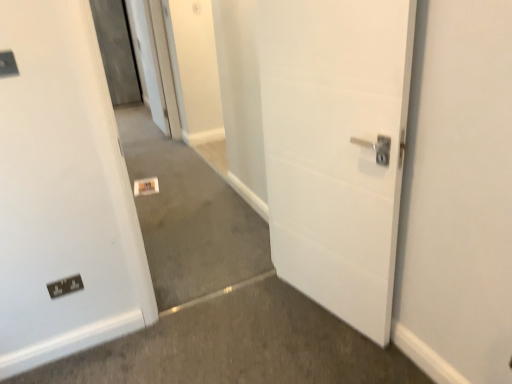
Find the location of a particular element. The height and width of the screenshot is (384, 512). neutral carpet at center is located at coordinates (189, 218).

Can you confirm if black plastic electric outlet at lower left is smaller than neutral carpet at center?

Indeed, black plastic electric outlet at lower left has a smaller size compared to neutral carpet at center.

Based on the photo, is black plastic electric outlet at lower left placed right next to neutral carpet at center?

There is a gap between black plastic electric outlet at lower left and neutral carpet at center.

Is black plastic electric outlet at lower left taller or shorter than neutral carpet at center?

Clearly, black plastic electric outlet at lower left is shorter compared to neutral carpet at center.

Which of these two, black plastic electric outlet at lower left or neutral carpet at center, is thinner?

black plastic electric outlet at lower left is thinner.

Is neutral carpet at center at the right side of matte black switch at upper left?

Yes, neutral carpet at center is to the right of matte black switch at upper left.

Is neutral carpet at center positioned with its back to matte black switch at upper left?

neutral carpet at center does not have its back to matte black switch at upper left.

From the image's perspective, is neutral carpet at center positioned above or below matte black switch at upper left?

Clearly, from the image's perspective, neutral carpet at center is below matte black switch at upper left.

Does neutral carpet at center have a larger size compared to matte black switch at upper left?

Yes, neutral carpet at center is bigger than matte black switch at upper left.

How different are the orientations of neutral carpet at center and black plastic electric outlet at lower left in degrees?

There is a 0.381-degree angle between the facing directions of neutral carpet at center and black plastic electric outlet at lower left.

In the scene shown: Is the depth of neutral carpet at center greater than that of black plastic electric outlet at lower left?

No, it is not.

Is neutral carpet at center to the right of black plastic electric outlet at lower left from the viewer's perspective?

Yes, neutral carpet at center is to the right of black plastic electric outlet at lower left.

Considering the sizes of objects neutral carpet at center and black plastic electric outlet at lower left in the image provided, who is thinner, neutral carpet at center or black plastic electric outlet at lower left?

Thinner between the two is black plastic electric outlet at lower left.

From the image's perspective, who appears lower, black plastic electric outlet at lower left or matte black switch at upper left?

black plastic electric outlet at lower left appears lower in the image.

Is matte black switch at upper left at the back of black plastic electric outlet at lower left?

black plastic electric outlet at lower left is not turned away from matte black switch at upper left.

From a real-world perspective, which is physically above, black plastic electric outlet at lower left or matte black switch at upper left?

From a 3D spatial view, matte black switch at upper left is above.

Measure the distance between black plastic electric outlet at lower left and matte black switch at upper left.

They are 38.09 inches apart.

Identify the location of light switch above the black plastic electric outlet at lower left (from a real-world perspective). Image resolution: width=512 pixels, height=384 pixels. (8, 64).

In terms of height, does matte black switch at upper left look taller or shorter compared to black plastic electric outlet at lower left?

Clearly, matte black switch at upper left is shorter compared to black plastic electric outlet at lower left.

Is matte black switch at upper left situated inside black plastic electric outlet at lower left or outside?

matte black switch at upper left cannot be found inside black plastic electric outlet at lower left.

In the scene shown: Which of these two, matte black switch at upper left or black plastic electric outlet at lower left, is smaller?

matte black switch at upper left.

From the image's perspective, does matte black switch at upper left appear lower than neutral carpet at center?

No, from the image's perspective, matte black switch at upper left is not beneath neutral carpet at center.

From a real-world perspective, is matte black switch at upper left positioned under neutral carpet at center based on gravity?

Incorrect, from a real-world perspective, matte black switch at upper left is higher than neutral carpet at center.

Between matte black switch at upper left and neutral carpet at center, which one has smaller size?

matte black switch at upper left.

Could you tell me if matte black switch at upper left is facing neutral carpet at center?

No.

Where is `electric outlet located behind the neutral carpet at center`? electric outlet located behind the neutral carpet at center is located at coordinates (65, 286).

This screenshot has width=512, height=384. What are the coordinates of `concrete located underneath the matte black switch at upper left (from a real-world perspective)` in the screenshot? It's located at (189, 218).

From the image, which object appears to be nearer to neutral carpet at center, matte black switch at upper left or black plastic electric outlet at lower left?

The object closer to neutral carpet at center is black plastic electric outlet at lower left.

Which object lies further to the anchor point neutral carpet at center, black plastic electric outlet at lower left or matte black switch at upper left?

matte black switch at upper left lies further to neutral carpet at center than the other object.

Looking at the image, which one is located further to matte black switch at upper left, neutral carpet at center or black plastic electric outlet at lower left?

neutral carpet at center is further to matte black switch at upper left.

Estimate the real-world distances between objects in this image. Which object is closer to black plastic electric outlet at lower left, matte black switch at upper left or neutral carpet at center?

The object closer to black plastic electric outlet at lower left is matte black switch at upper left.

Which object lies nearer to the anchor point black plastic electric outlet at lower left, neutral carpet at center or matte black switch at upper left?

Among the two, matte black switch at upper left is located nearer to black plastic electric outlet at lower left.

Looking at this image, which object lies further to the anchor point matte black switch at upper left, black plastic electric outlet at lower left or neutral carpet at center?

neutral carpet at center is further to matte black switch at upper left.

Identify the location of concrete between matte black switch at upper left and black plastic electric outlet at lower left vertically. (189, 218).